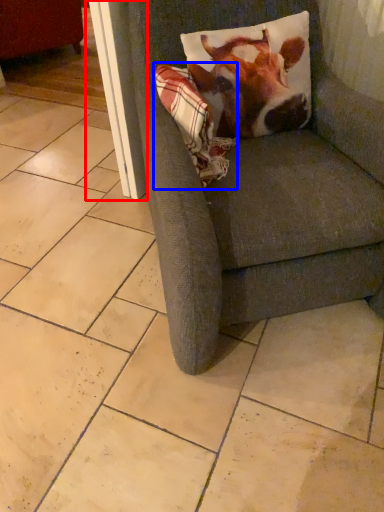
Question: Which point is further to the camera, screen door (highlighted by a red box) or blanket (highlighted by a blue box)?

Choices:
 (A) screen door
 (B) blanket

Answer: (A)